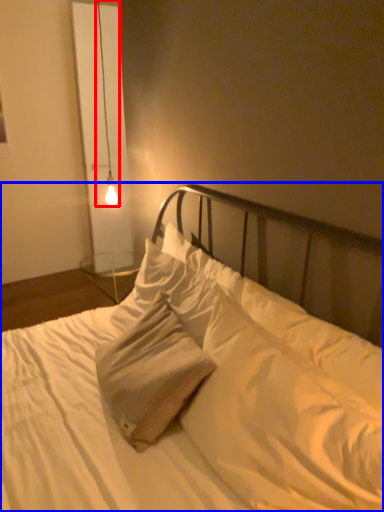
Question: Which object appears farthest to the camera in this image, lamp (highlighted by a red box) or bed (highlighted by a blue box)?

Choices:
 (A) lamp
 (B) bed

Answer: (A)